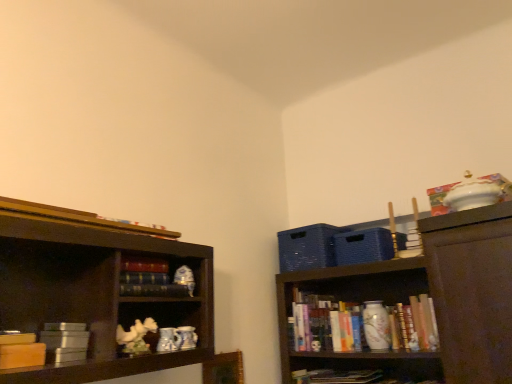
Question: In the image, is black matte bookshelf at center, which is counted as the 2th book, starting from the back, on the left side or the right side of hardcover book at upper left, placed as the fifth book when sorted from bottom to top?

Choices:
 (A) right
 (B) left

Answer: (A)

Question: Looking at their shapes, would you say black matte bookshelf at center, the fourth book in the bottom-to-top sequence, is wider or thinner than hardcover book at upper left, which is counted as the 3th book, starting from the left?

Choices:
 (A) thin
 (B) wide

Answer: (A)

Question: Based on their relative distances, which object is nearer to the matte yellow book at left, placed as the second book when sorted from front to back?

Choices:
 (A) hardcover book at center, placed as the first book when sorted from right to left
 (B) metallic silver book at lower left, which is the 3th book in front-to-back order
 (C) black matte bookshelf at center, which is counted as the 2th book, starting from the back
 (D) hardcover book at upper left, marked as the third book in a right-to-left arrangement

Answer: (B)

Question: Which is nearer to the black matte bookshelf at center, which is counted as the fourth book, starting from the front?

Choices:
 (A) hardcover book at center, which appears as the first book when ordered from the bottom
 (B) metallic silver book at lower left, marked as the 3th book in a back-to-front arrangement
 (C) matte yellow book at left, which is the fourth book from back to front
 (D) hardcover book at upper left, placed as the fifth book when sorted from bottom to top

Answer: (B)